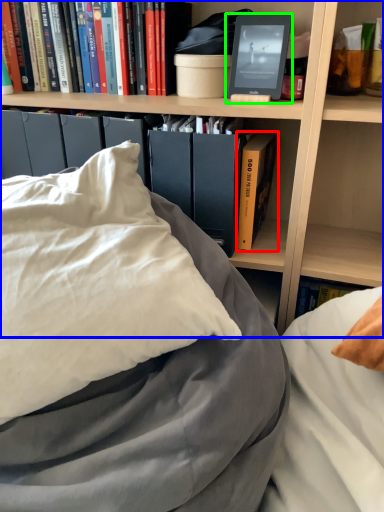
Question: Based on their relative distances, which object is nearer to book (highlighted by a red box)? Choose from bookcase (highlighted by a blue box) and paperback book (highlighted by a green box).

Choices:
 (A) bookcase
 (B) paperback book

Answer: (A)